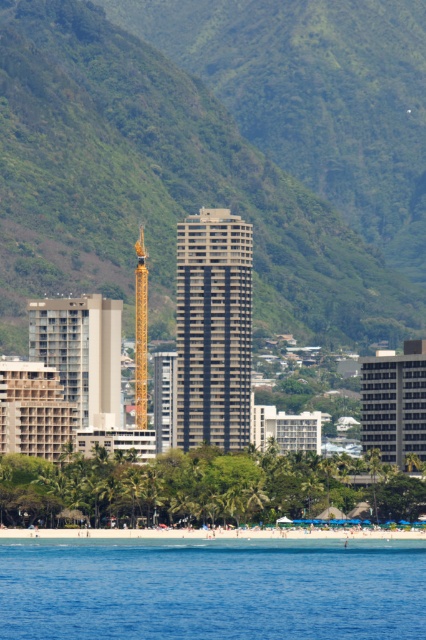
From the picture: You are an architect designing a new coastal development. You need to place a new structure such that it aligns with the green leafy hill at center. What coordinates should you use for the center of your new structure?

The green leafy hill at center is located at coordinates point [158,188], so the new structure should be placed at the same coordinates to align with it.